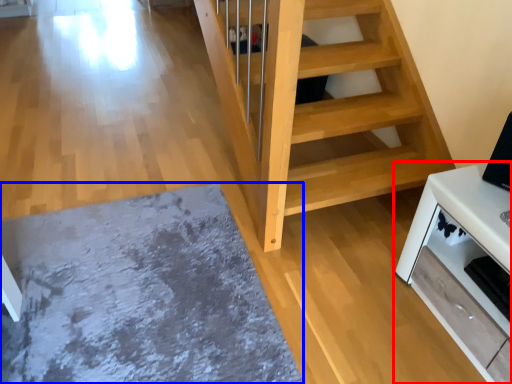
Question: Which point is closer to the camera, furniture (highlighted by a red box) or mat (highlighted by a blue box)?

Choices:
 (A) furniture
 (B) mat

Answer: (A)